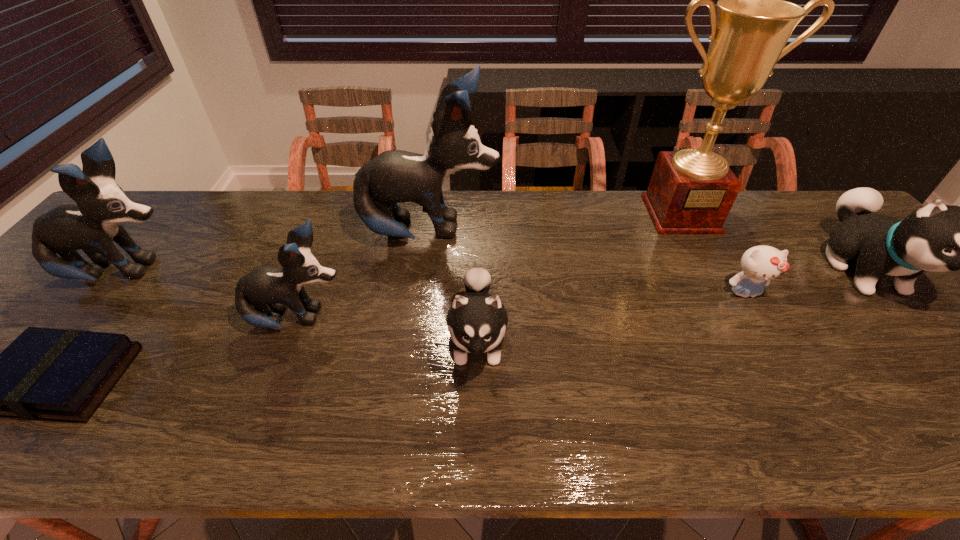
At what (x,y) coordinates should I click in order to perform the action: click on vacant area that lies between the second nearest black puppy and the rightmost object. Please return your answer as a coordinate pair (x, y). This screenshot has height=540, width=960. Looking at the image, I should click on (494, 272).

Locate an element on the screen. The height and width of the screenshot is (540, 960). free point between the left white puppy and the nearest black puppy is located at coordinates (388, 329).

You are a GUI agent. You are given a task and a screenshot of the screen. Output one action in this format:
    pyautogui.click(x=<x>, y=<y>)
    Task: Click on the vacant space in between the kitten and the biggest black puppy
    This screenshot has width=960, height=540.
    Given the screenshot: What is the action you would take?
    pyautogui.click(x=588, y=262)

You are a GUI agent. You are given a task and a screenshot of the screen. Output one action in this format:
    pyautogui.click(x=<x>, y=<y>)
    Task: Click on the free spot between the tallest puppy and the smallest black puppy
    The image size is (960, 540).
    Given the screenshot: What is the action you would take?
    pyautogui.click(x=364, y=276)

Identify the location of object that ranks as the sixth closest to the rightmost puppy. (49, 374).

Locate which object is the fifth closest to the shortest puppy. Please provide its 2D coordinates. Your answer should be formatted as a tuple, i.e. [(x, y)], where the tuple contains the x and y coordinates of a point satisfying the conditions above.

[(49, 374)]

What are the coordinates of `puppy object that ranks as the second closest to the second nearest black puppy` in the screenshot? It's located at (394, 176).

This screenshot has height=540, width=960. Find the location of `puppy that stands as the fifth closest to the second shortest object`. puppy that stands as the fifth closest to the second shortest object is located at coordinates (92, 225).

Identify which black puppy is the closest to the smallest black puppy. Please provide its 2D coordinates. Your answer should be formatted as a tuple, i.e. [(x, y)], where the tuple contains the x and y coordinates of a point satisfying the conditions above.

[(394, 176)]

Locate an element on the screen. The image size is (960, 540). black puppy that is the closest to the tallest object is located at coordinates (394, 176).